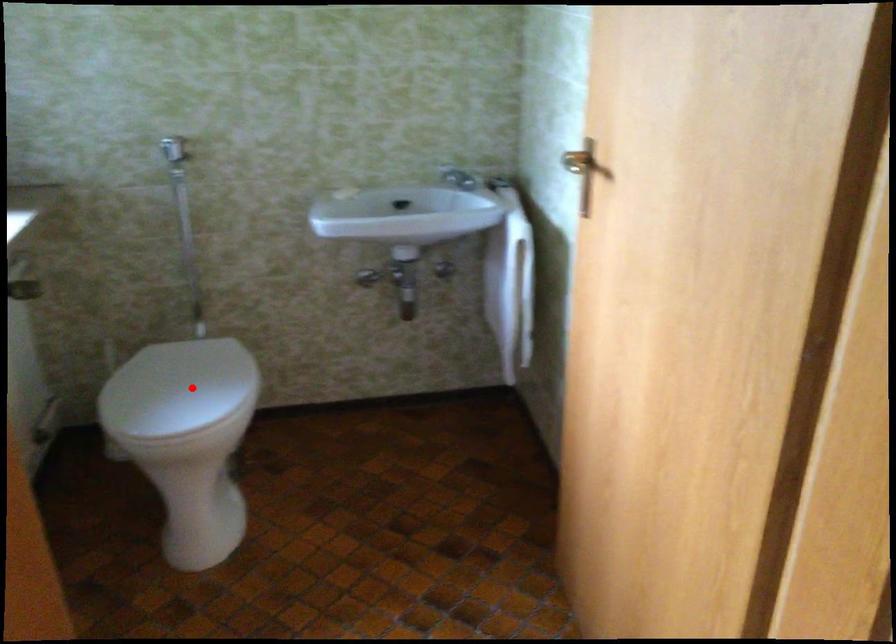
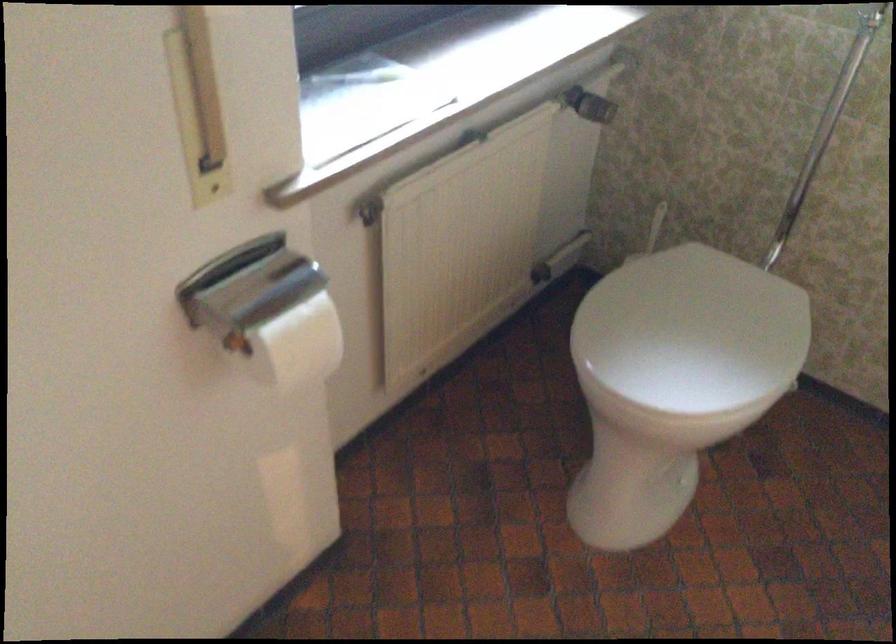
Question: I am providing you with two images of the same scene from different viewpoints. Given a red point in image1, look at the same physical point in image2. Is it:

Choices:
 (A) Closer to the viewpoint
 (B) Farther from the viewpoint

Answer: (A)